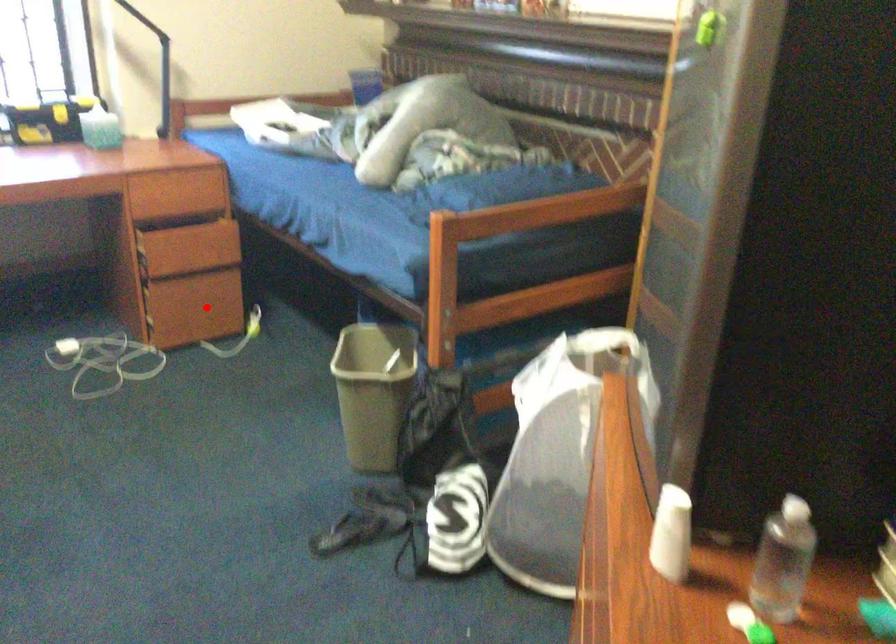
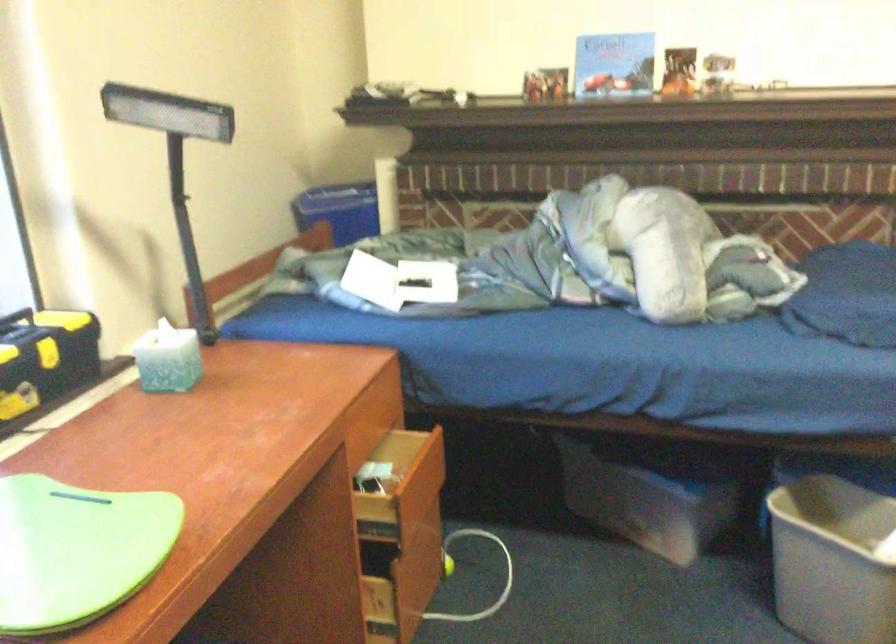
Question: I am providing you with two images of the same scene from different viewpoints. In image1, a red point is highlighted. Considering the same 3D point in image2, which of the following is correct?

Choices:
 (A) It is closer
 (B) It is farther

Answer: (A)